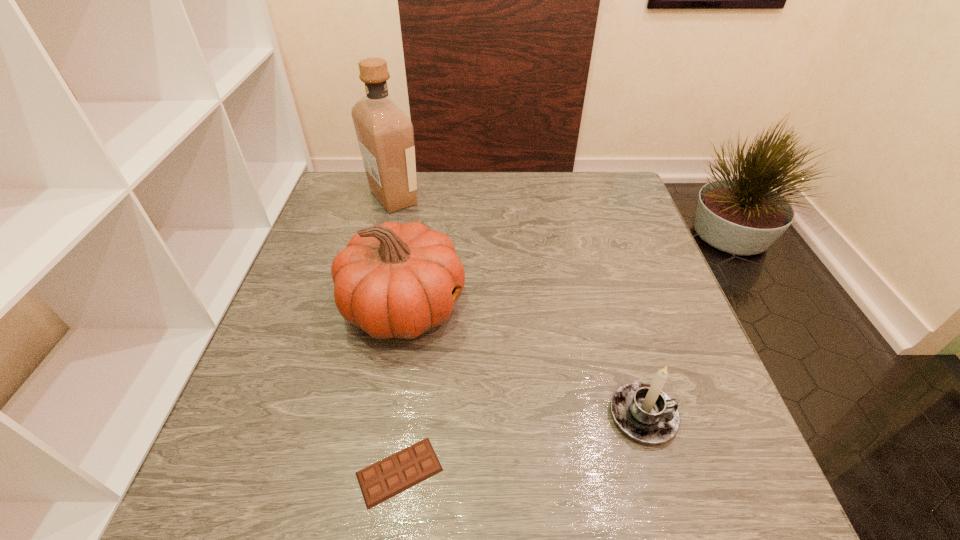
I want to click on the tallest object, so click(385, 134).

Locate an element on the screen. the farthest object is located at coordinates [x=385, y=134].

You are a GUI agent. You are given a task and a screenshot of the screen. Output one action in this format:
    pyautogui.click(x=<x>, y=<y>)
    Task: Click on the second tallest object
    
    Given the screenshot: What is the action you would take?
    pyautogui.click(x=393, y=280)

The width and height of the screenshot is (960, 540). Find the location of `pumpkin`. pumpkin is located at coordinates (393, 280).

Locate an element on the screen. The height and width of the screenshot is (540, 960). the rightmost object is located at coordinates (644, 412).

Image resolution: width=960 pixels, height=540 pixels. Identify the location of candle holder. (644, 412).

You are a GUI agent. You are given a task and a screenshot of the screen. Output one action in this format:
    pyautogui.click(x=<x>, y=<y>)
    Task: Click on the chocolate bar
    This screenshot has width=960, height=540.
    Given the screenshot: What is the action you would take?
    [x=396, y=473]

Identify the location of vacant area located on the front-facing side of the tallest object. The height and width of the screenshot is (540, 960). (531, 198).

I want to click on vacant area situated 0.270m on the face of the pumpkin, so click(x=586, y=307).

Find the location of `free space located 0.060m with a handle on the side of the third tallest object`. free space located 0.060m with a handle on the side of the third tallest object is located at coordinates (709, 416).